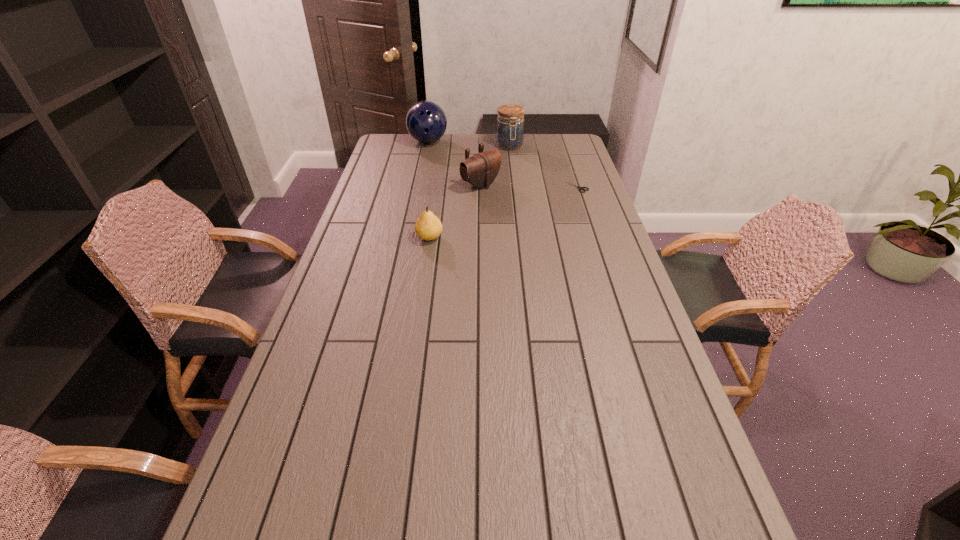
Find the location of `vacant space on the desktop that is between the pear and the rightmost object and is positioned with the flap open on the pouch`. vacant space on the desktop that is between the pear and the rightmost object and is positioned with the flap open on the pouch is located at coordinates (519, 206).

This screenshot has height=540, width=960. Find the location of `free space on the desktop that is between the fourth tallest object and the rightmost object and is positioned on the surface of the bowling ball near the finger holes`. free space on the desktop that is between the fourth tallest object and the rightmost object and is positioned on the surface of the bowling ball near the finger holes is located at coordinates (489, 217).

In order to click on free space on the desktop that is between the pear and the rightmost object and is positioned on the lid of the jar in this screenshot , I will do `click(529, 203)`.